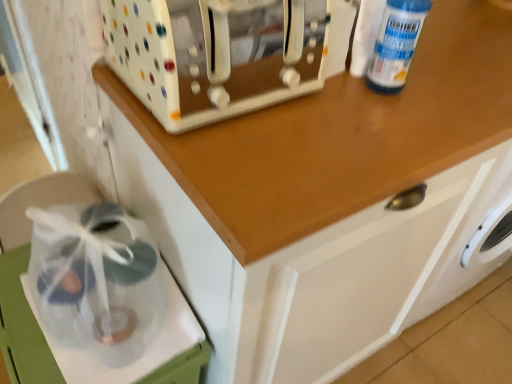
What are the coordinates of `unoccupied region to the right of white glossy toaster at upper center` in the screenshot? It's located at (358, 121).